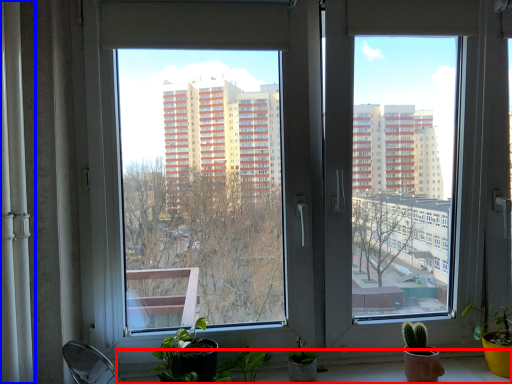
Question: Which point is further to the camera, window sill (highlighted by a red box) or curtain (highlighted by a blue box)?

Choices:
 (A) window sill
 (B) curtain

Answer: (A)